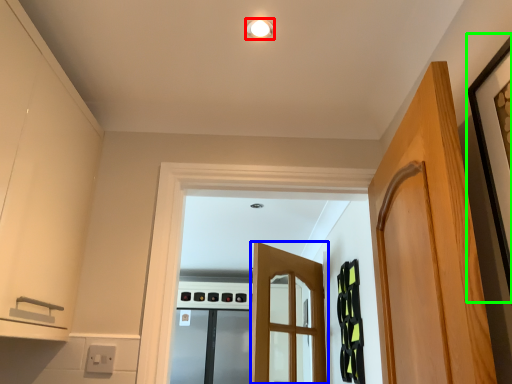
Question: Which object is the farthest from light fixture (highlighted by a red box)? Choose among these: door (highlighted by a blue box) or picture frame (highlighted by a green box).

Choices:
 (A) door
 (B) picture frame

Answer: (A)